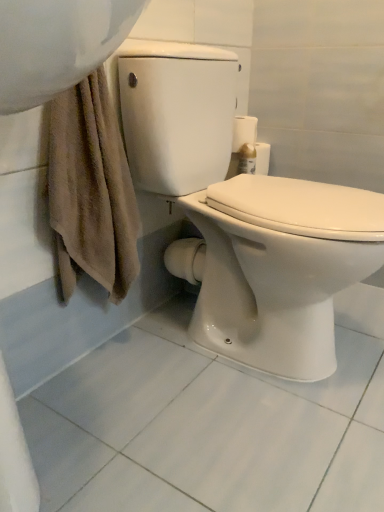
Question: In the image, is white glossy toilet paper at upper right positioned in front of or behind white glossy toilet at center?

Choices:
 (A) behind
 (B) front

Answer: (A)

Question: Looking at the image, does white glossy toilet paper at upper right seem bigger or smaller compared to white glossy toilet at center?

Choices:
 (A) small
 (B) big

Answer: (A)

Question: Is white glossy toilet paper at upper right taller or shorter than white glossy toilet at center?

Choices:
 (A) tall
 (B) short

Answer: (B)

Question: In the image, is white glossy toilet at center positioned in front of or behind white glossy toilet paper at upper right?

Choices:
 (A) behind
 (B) front

Answer: (B)

Question: Would you say white glossy toilet at center is to the left or to the right of white glossy toilet paper at upper right in the picture?

Choices:
 (A) right
 (B) left

Answer: (B)

Question: From a real-world perspective, is white glossy toilet at center positioned above or below white glossy toilet paper at upper right?

Choices:
 (A) below
 (B) above

Answer: (A)

Question: From the image's perspective, relative to white glossy toilet paper at upper right, is white glossy toilet at center above or below?

Choices:
 (A) below
 (B) above

Answer: (A)